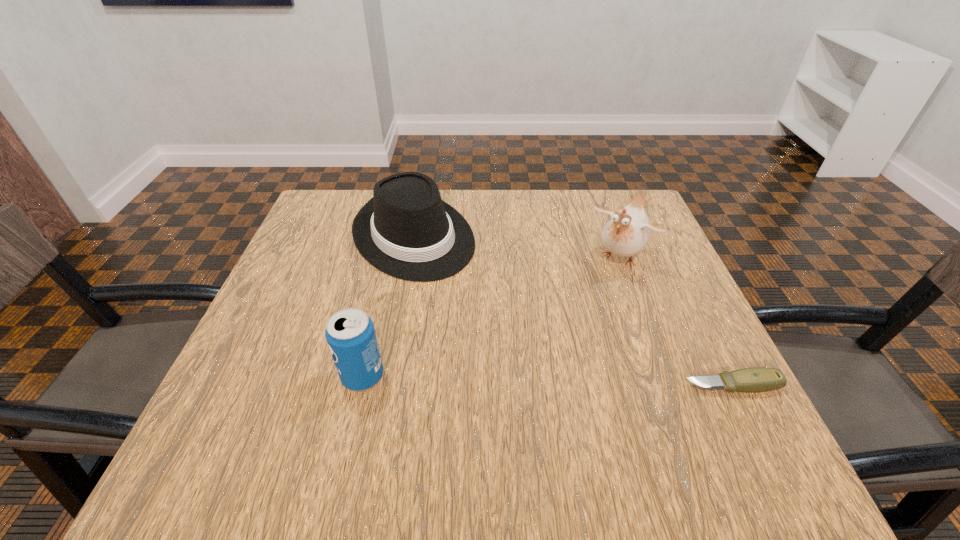
Identify the location of vacant space that satisfies the following two spatial constraints: 1. on the front side of the fedora; 2. on the right side of the shortest object. The image size is (960, 540). (385, 386).

The width and height of the screenshot is (960, 540). I want to click on free space that satisfies the following two spatial constraints: 1. on the front side of the tallest object; 2. on the right side of the fedora, so tap(409, 258).